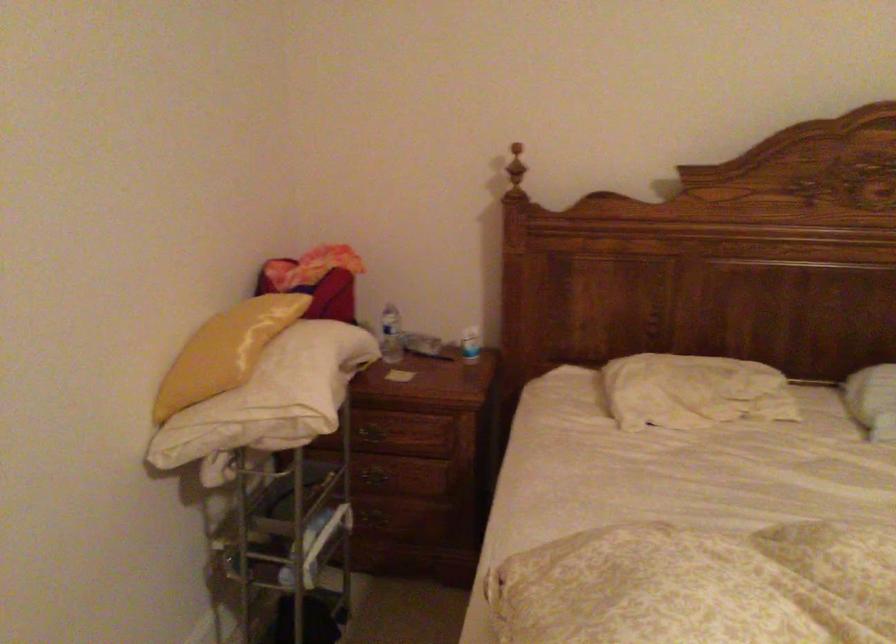
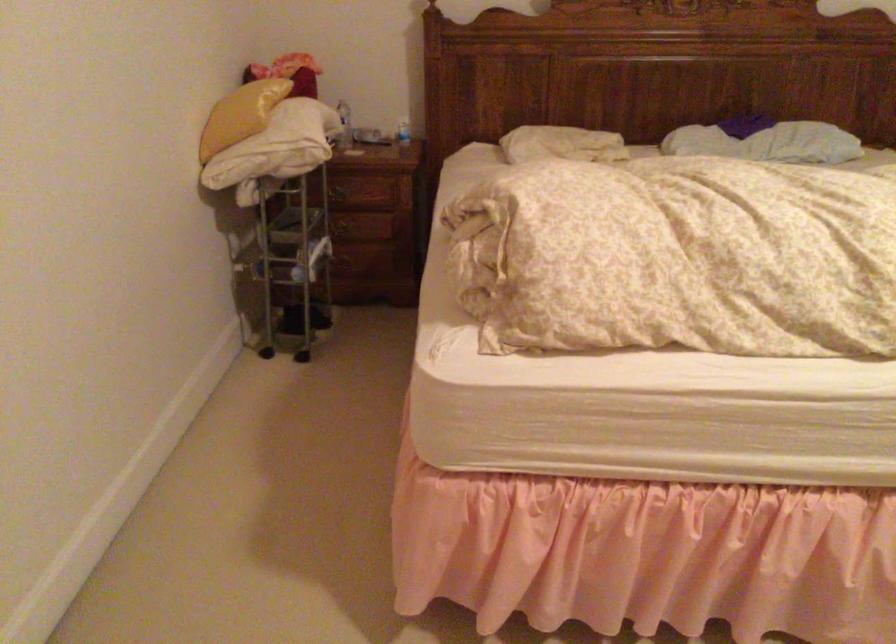
In the second image, find the point that corresponds to (x=366, y=436) in the first image.

(338, 194)